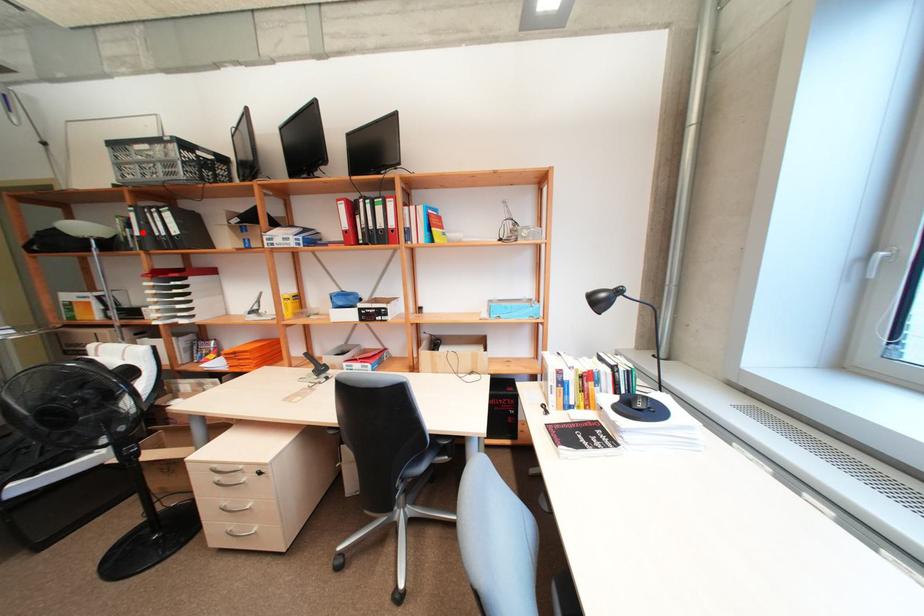
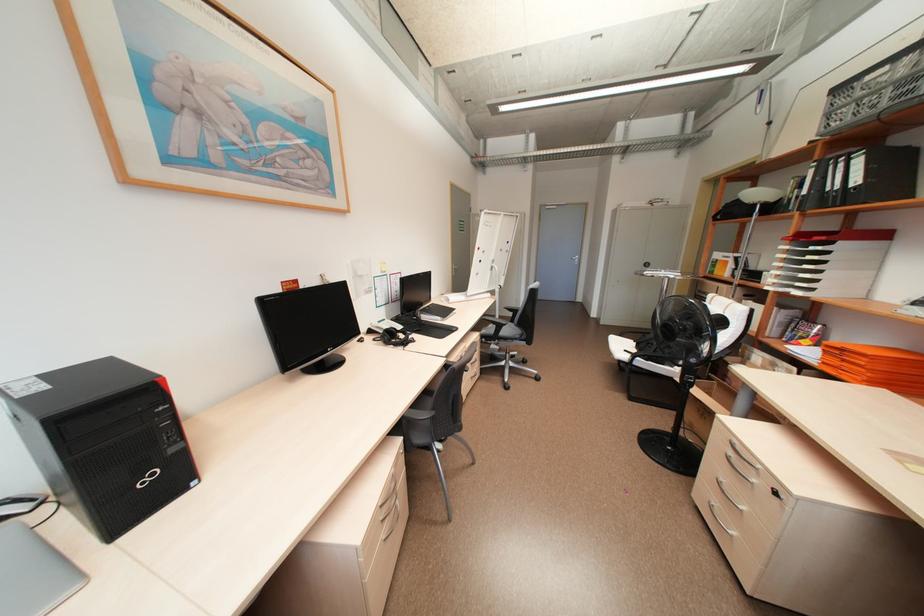
In the second image, find the point that corresponds to the highlighted location in the first image.

(810, 191)